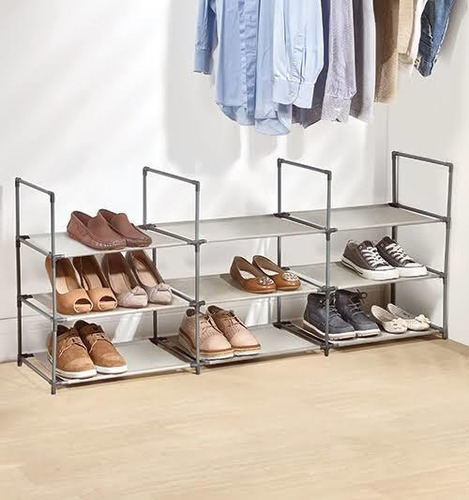
I want to click on shoe shelf, so click(x=152, y=358), click(x=165, y=306), click(x=156, y=239), click(x=214, y=228), click(x=351, y=207), click(x=340, y=278), click(x=369, y=336), click(x=265, y=342), click(x=208, y=299).